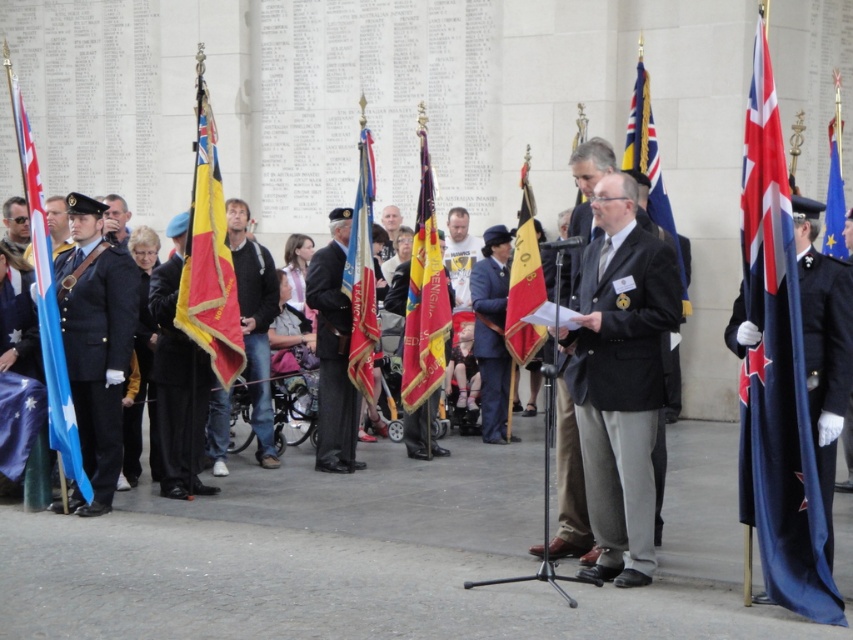
Question: Can you confirm if shiny dark blue uniform at left is thinner than red fabric flag at center?

Choices:
 (A) yes
 (B) no

Answer: (B)

Question: Considering the relative positions of gold metallic flag at center and blue fabric flag at upper right in the image provided, where is gold metallic flag at center located with respect to blue fabric flag at upper right?

Choices:
 (A) right
 (B) left

Answer: (B)

Question: Which of the following is the farthest from the observer?

Choices:
 (A) blue fabric uniform at center
 (B) red/yellow fabric flag at center
 (C) white matte jacket at center
 (D) blue fabric flag at center

Answer: (C)

Question: Among these objects, which one is nearest to the camera?

Choices:
 (A) gold metallic flag at center
 (B) blue fabric uniform at center
 (C) red fabric flag at center

Answer: (C)

Question: Among these objects, which one is farthest from the camera?

Choices:
 (A) white matte jacket at center
 (B) blue fabric flag at center
 (C) black fabric uniform at center

Answer: (A)

Question: Observing the image, what is the correct spatial positioning of black wool suit at center in reference to black fabric uniform at center?

Choices:
 (A) right
 (B) left

Answer: (A)